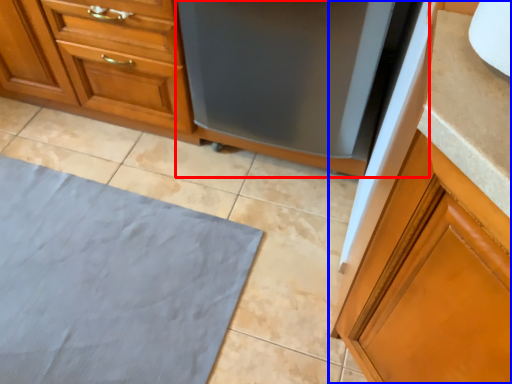
Question: Among these objects, which one is farthest to the camera, appliance (highlighted by a red box) or cabinetry (highlighted by a blue box)?

Choices:
 (A) appliance
 (B) cabinetry

Answer: (A)